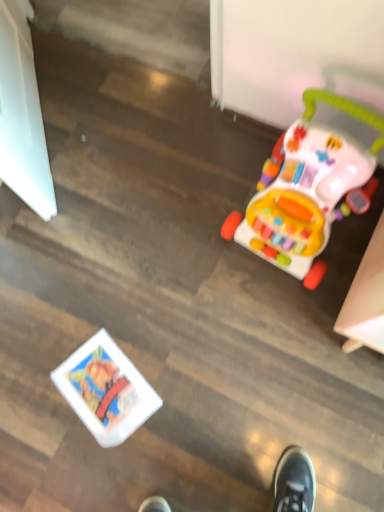
Find the location of a particular element. The width and height of the screenshot is (384, 512). free location to the left of multicolored plastic walker at right, positioned as the first toy in top-to-bottom order is located at coordinates (193, 233).